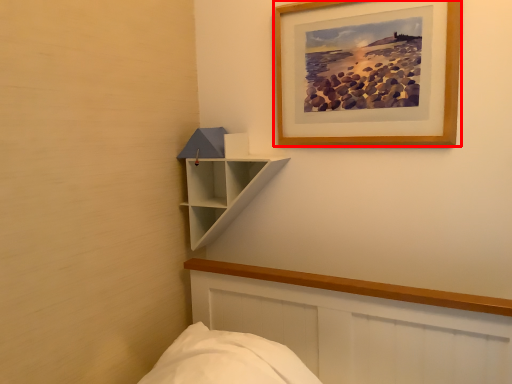
Question: From the image's perspective, what is the correct spatial relationship of picture frame (annotated by the red box) in relation to shelf?

Choices:
 (A) below
 (B) above

Answer: (B)